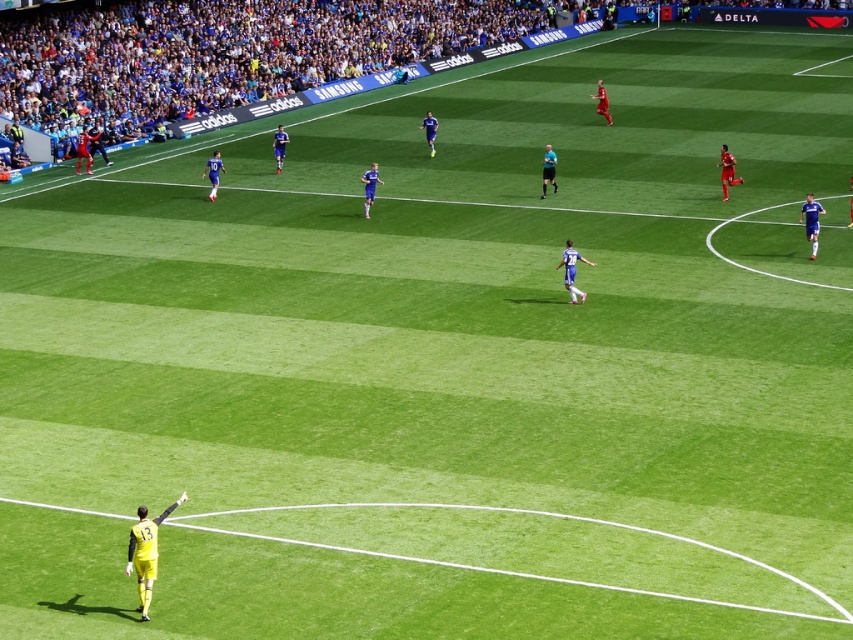
Locate an element on the screen. The image size is (853, 640). blue jersey at center is located at coordinates (369, 186).

Can you confirm if blue jersey at center is bigger than black uniform at center?

Indeed, blue jersey at center has a larger size compared to black uniform at center.

Between point (363, 172) and point (553, 193), which one is positioned behind?

The point (363, 172) is more distant.

What are the coordinates of `blue jersey at center` in the screenshot? It's located at (369, 186).

Does blue fabric jersey at upper left have a lesser height compared to blue smooth soccer player at center?

Incorrect, blue fabric jersey at upper left's height does not fall short of blue smooth soccer player at center's.

Can you confirm if blue fabric jersey at upper left is positioned to the right of blue smooth soccer player at center?

No, blue fabric jersey at upper left is not to the right of blue smooth soccer player at center.

Is point (212, 177) closer to viewer compared to point (430, 115)?

Yes.

Where is `blue fabric jersey at upper left`? blue fabric jersey at upper left is located at coordinates (213, 173).

Between blue jersey at right and red matte jersey at upper right, which one has more height?

red matte jersey at upper right is taller.

In the scene shown: Is blue jersey at right below red matte jersey at upper right?

Yes, blue jersey at right is below red matte jersey at upper right.

Between point (811, 252) and point (732, 179), which one is positioned behind?

The point (732, 179) is more distant.

Identify the location of blue jersey at right. (811, 221).